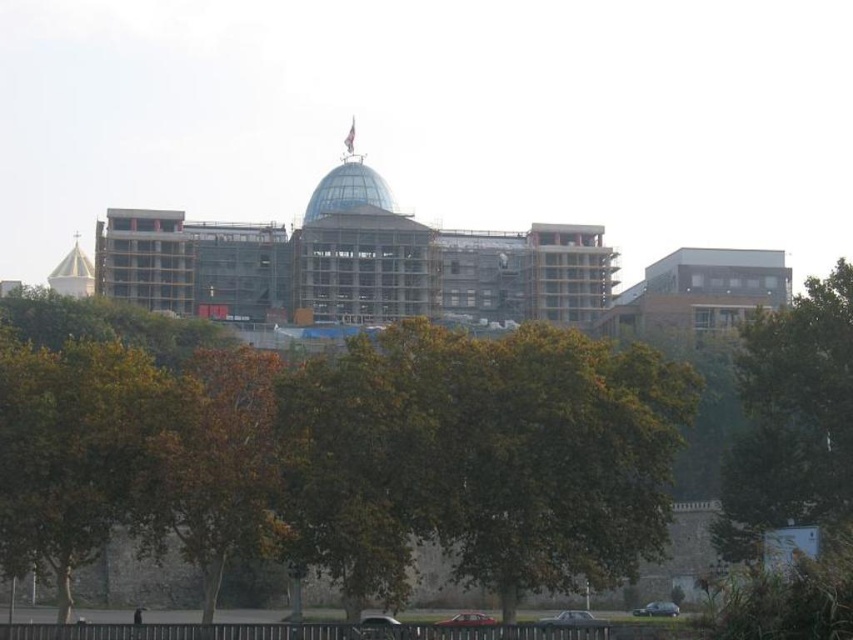
Question: Can you confirm if green leafy tree at lower left is positioned below green leafy tree at right?

Choices:
 (A) yes
 (B) no

Answer: (A)

Question: Which of these objects is positioned farthest from the green leafy tree at center?

Choices:
 (A) green leafy tree at right
 (B) green leafy tree at lower left
 (C) brown leafy tree at center

Answer: (A)

Question: Can you confirm if green leafy tree at center is positioned to the right of green leafy tree at right?

Choices:
 (A) yes
 (B) no

Answer: (B)

Question: Which point is closer to the camera?

Choices:
 (A) green leafy tree at center
 (B) brown leafy tree at center
 (C) green leafy tree at right

Answer: (A)

Question: Is green leafy tree at center below green leafy tree at lower left?

Choices:
 (A) yes
 (B) no

Answer: (B)

Question: Which point is closer to the camera?

Choices:
 (A) brown leafy tree at center
 (B) green leafy tree at center

Answer: (B)